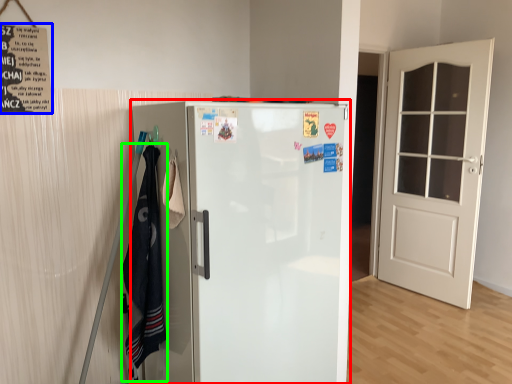
Question: Considering the real-world distances, which object is farthest from refrigerator (highlighted by a red box)? poster (highlighted by a blue box) or laundry (highlighted by a green box)?

Choices:
 (A) poster
 (B) laundry

Answer: (A)